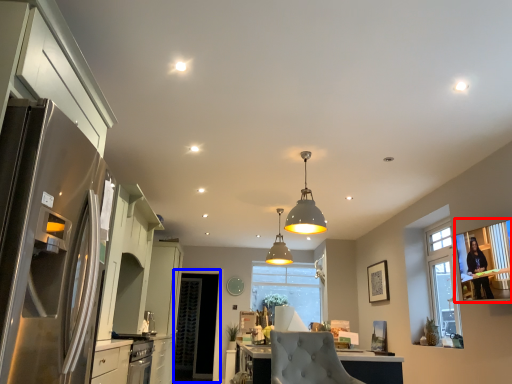
Question: Among these objects, which one is farthest to the camera, window screen (highlighted by a red box) or glass door (highlighted by a blue box)?

Choices:
 (A) window screen
 (B) glass door

Answer: (B)